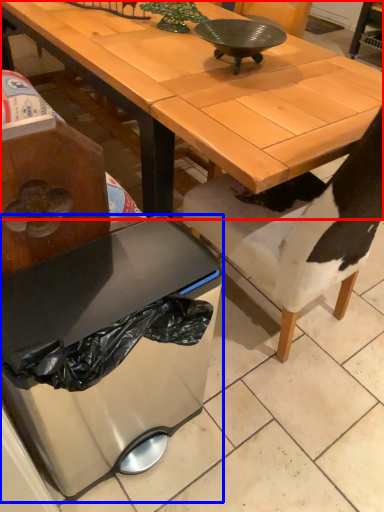
Question: Which object appears closest to the camera in this image, desk (highlighted by a red box) or trash bin/can (highlighted by a blue box)?

Choices:
 (A) desk
 (B) trash bin/can

Answer: (B)